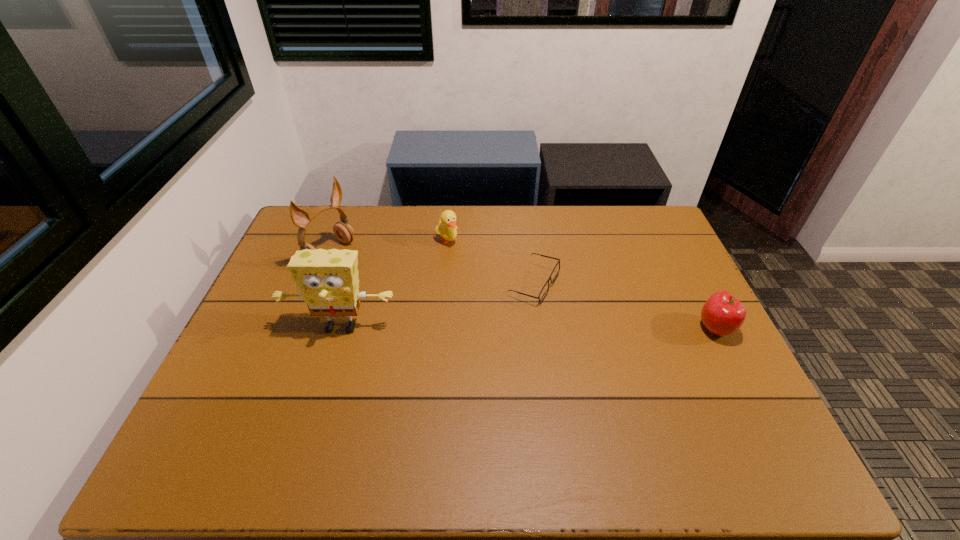
Identify the location of earphone that is at the left edge. (343, 231).

Where is `object present at the right edge`? Image resolution: width=960 pixels, height=540 pixels. object present at the right edge is located at coordinates (722, 314).

Where is `object that is at the far left corner`? The image size is (960, 540). object that is at the far left corner is located at coordinates (343, 231).

Identify the location of free space at the far edge of the desktop. The image size is (960, 540). (366, 242).

In the image, there is a desktop. What are the coordinates of `vacant space at the near edge` in the screenshot? It's located at (570, 399).

The height and width of the screenshot is (540, 960). Find the location of `vacant space at the left edge of the desktop`. vacant space at the left edge of the desktop is located at coordinates (230, 357).

Find the location of a particular element. This screenshot has height=540, width=960. vacant space at the right edge of the desktop is located at coordinates (690, 286).

Find the location of a particular element. free space at the far left corner is located at coordinates (339, 207).

In the image, there is a desktop. Identify the location of free space at the near left corner. (263, 413).

You are a GUI agent. You are given a task and a screenshot of the screen. Output one action in this format:
    pyautogui.click(x=<x>, y=<y>)
    Task: Click on the free space at the far right corner of the desktop
    
    Given the screenshot: What is the action you would take?
    pyautogui.click(x=653, y=234)